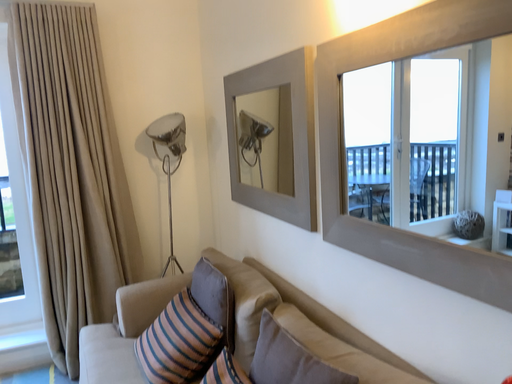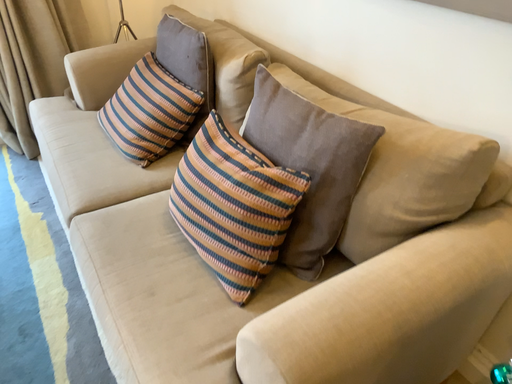
Question: How did the camera likely rotate when shooting the video?

Choices:
 (A) rotated upward
 (B) rotated downward

Answer: (B)